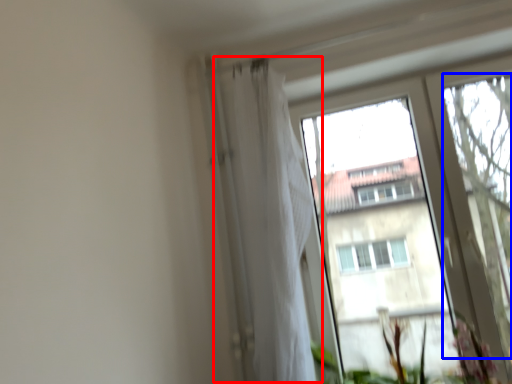
Question: Among these objects, which one is nearest to the camera, shower curtain (highlighted by a red box) or tree (highlighted by a blue box)?

Choices:
 (A) shower curtain
 (B) tree

Answer: (A)